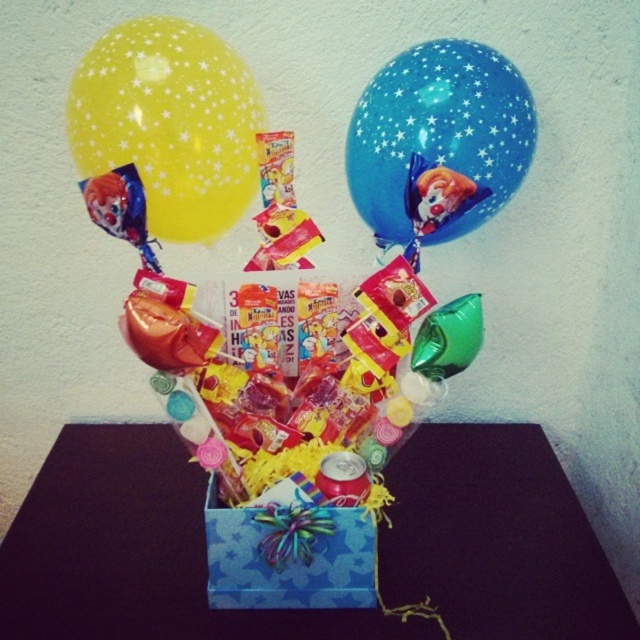
You are a delivery person trying to place a new gift box on the table. The table is 36 inches long. There is already a blue cardboard box at center on it. Can you fit another gift box next to it without exceeding the table length?

The blue cardboard box at center and the new gift box are 36.47 inches apart, so placing another gift box next to the blue cardboard box at center would exceed the table length of 36 inches.

You are standing in front of the festive arrangement and want to place a small decoration between the two points, point [35,618] and point [106,184]. Which point is closer to you so that you can place the decoration in front of it?

Point [35,618] is further to the viewer than point [106,184], so the point closer to you is point [106,184]. Place the decoration in front of point [106,184].